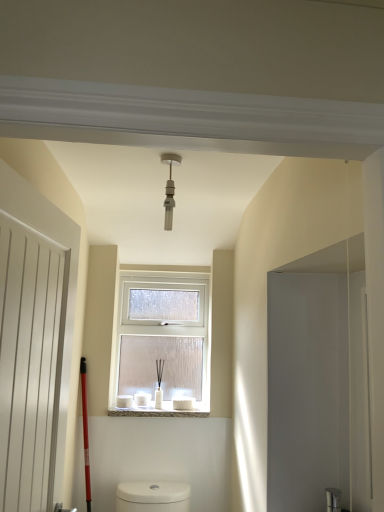
What are the coordinates of `white marble window sill at center` in the screenshot? It's located at (161, 410).

From the image's perspective, is white frosted glass window at center located above or below white matte door at left?

Based on their image positions, white frosted glass window at center is located beneath white matte door at left.

How much distance is there between white frosted glass window at center and white matte door at left?

4.18 feet.

In order to click on window below the white matte door at left (from the image's perspective) in this screenshot , I will do `click(163, 341)`.

Is point (190, 367) less distant than point (68, 401)?

No, it is behind (68, 401).

Is white frosted glass window at center wider or thinner than white marble window sill at center?

white frosted glass window at center is thinner than white marble window sill at center.

Can you confirm if white frosted glass window at center is shorter than white marble window sill at center?

No, white frosted glass window at center is not shorter than white marble window sill at center.

Considering the positions of objects white frosted glass window at center and white marble window sill at center in the image provided, who is more to the right, white frosted glass window at center or white marble window sill at center?

white frosted glass window at center.

Does point (29, 200) come behind point (165, 220)?

That is False.

From the picture: Is white matte door at left oriented towards matte silver light fixture at center?

No, white matte door at left does not turn towards matte silver light fixture at center.

Is white matte door at left closer to the viewer compared to matte silver light fixture at center?

Yes, white matte door at left is in front of matte silver light fixture at center.

Looking at this image, from a real-world perspective, between white marble window sill at center and white matte door at left, who is vertically lower?

white marble window sill at center, from a real-world perspective.

From the picture: Is the position of white marble window sill at center more distant than that of white matte door at left?

That is True.

Which of these two, white marble window sill at center or white matte door at left, stands shorter?

Standing shorter between the two is white marble window sill at center.

Looking at their sizes, would you say white marble window sill at center is wider or thinner than white matte door at left?

In the image, white marble window sill at center appears to be wider than white matte door at left.

Is white frosted glass window at center inside matte silver light fixture at center?

No, white frosted glass window at center is not a part of matte silver light fixture at center.

How distant is matte silver light fixture at center from white frosted glass window at center?

matte silver light fixture at center is 1.18 meters from white frosted glass window at center.

What's the angular difference between matte silver light fixture at center and white frosted glass window at center's facing directions?

0.115 degrees separate the facing orientations of matte silver light fixture at center and white frosted glass window at center.

Looking at this image, who is bigger, matte silver light fixture at center or white frosted glass window at center?

Bigger between the two is white frosted glass window at center.

Is point (58, 366) closer or farther from the camera than point (152, 377)?

Point (58, 366) is positioned closer to the camera compared to point (152, 377).

Is white matte door at left bigger than white frosted glass window at center?

Correct, white matte door at left is larger in size than white frosted glass window at center.

Does white matte door at left lie behind white frosted glass window at center?

No, it is not.

Based on the photo, is white matte door at left positioned beyond the bounds of white frosted glass window at center?

white matte door at left lies outside white frosted glass window at center's area.

Does white marble window sill at center contain white frosted glass window at center?

No.

Is white marble window sill at center touching white frosted glass window at center?

white marble window sill at center and white frosted glass window at center are clearly separated.

Locate an element on the screen. The image size is (384, 512). window sill that appears below the white frosted glass window at center (from a real-world perspective) is located at coordinates (161, 410).

Is white frosted glass window at center at the back of white marble window sill at center?

No.

Find the location of `window that appears below the white matte door at left (from the image's perspective)`. window that appears below the white matte door at left (from the image's perspective) is located at coordinates (163, 341).

You are a GUI agent. You are given a task and a screenshot of the screen. Output one action in this format:
    pyautogui.click(x=<x>, y=<y>)
    Task: Click on the window sill below the white frosted glass window at center (from a real-world perspective)
    This screenshot has width=384, height=512.
    Given the screenshot: What is the action you would take?
    pyautogui.click(x=161, y=410)

Considering their positions, is white matte door at left positioned closer to white marble window sill at center than white frosted glass window at center?

white frosted glass window at center is positioned closer to the anchor white marble window sill at center.

When comparing their distances from white marble window sill at center, does matte silver light fixture at center or white matte door at left seem closer?

The object closer to white marble window sill at center is white matte door at left.

Which object lies nearer to the anchor point white marble window sill at center, white frosted glass window at center or white matte door at left?

white frosted glass window at center lies closer to white marble window sill at center than the other object.

Estimate the real-world distances between objects in this image. Which object is further from white frosted glass window at center, white marble window sill at center or matte silver light fixture at center?

matte silver light fixture at center is further to white frosted glass window at center.

When comparing their distances from matte silver light fixture at center, does white frosted glass window at center or white marble window sill at center seem further?

white marble window sill at center is further to matte silver light fixture at center.

Which object lies further to the anchor point white frosted glass window at center, white matte door at left or white marble window sill at center?

white matte door at left is further to white frosted glass window at center.

Based on their spatial positions, is white matte door at left or white frosted glass window at center further from matte silver light fixture at center?

white frosted glass window at center is positioned further to the anchor matte silver light fixture at center.

Looking at the image, which one is located further to matte silver light fixture at center, white marble window sill at center or white frosted glass window at center?

white marble window sill at center is positioned further to the anchor matte silver light fixture at center.

Identify the location of light fixture between white matte door at left and white frosted glass window at center from front to back. (170, 188).

At what (x,y) coordinates should I click in order to perform the action: click on window between matte silver light fixture at center and white marble window sill at center in the vertical direction. Please return your answer as a coordinate pair (x, y). This screenshot has height=512, width=384. Looking at the image, I should click on (163, 341).

At what (x,y) coordinates should I click in order to perform the action: click on light fixture positioned between white matte door at left and white marble window sill at center from near to far. Please return your answer as a coordinate pair (x, y). The height and width of the screenshot is (512, 384). Looking at the image, I should click on (170, 188).

The width and height of the screenshot is (384, 512). Identify the location of window sill between white matte door at left and white frosted glass window at center in the front-back direction. (161, 410).